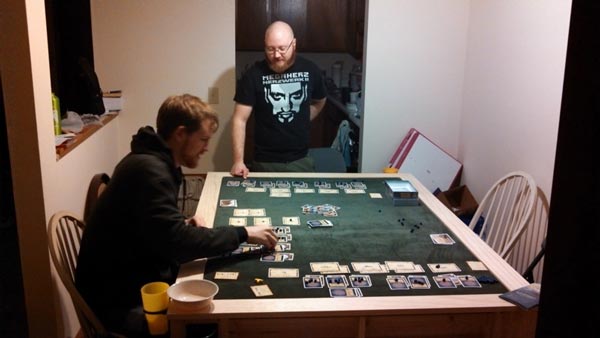
I want to click on walls, so click(70, 174), click(166, 55), click(512, 99).